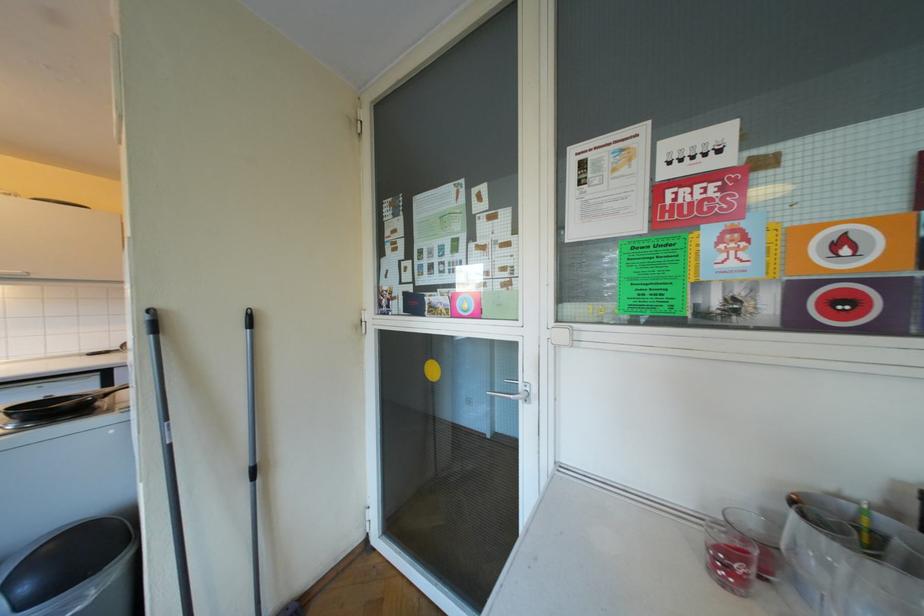
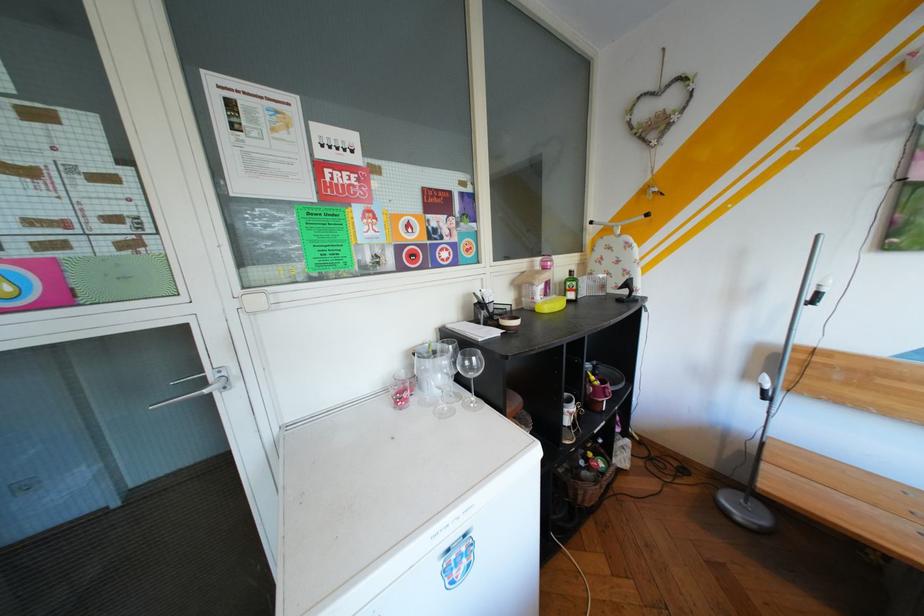
Locate, in the second image, the point that corresponds to point (756, 578) in the first image.

(419, 399)